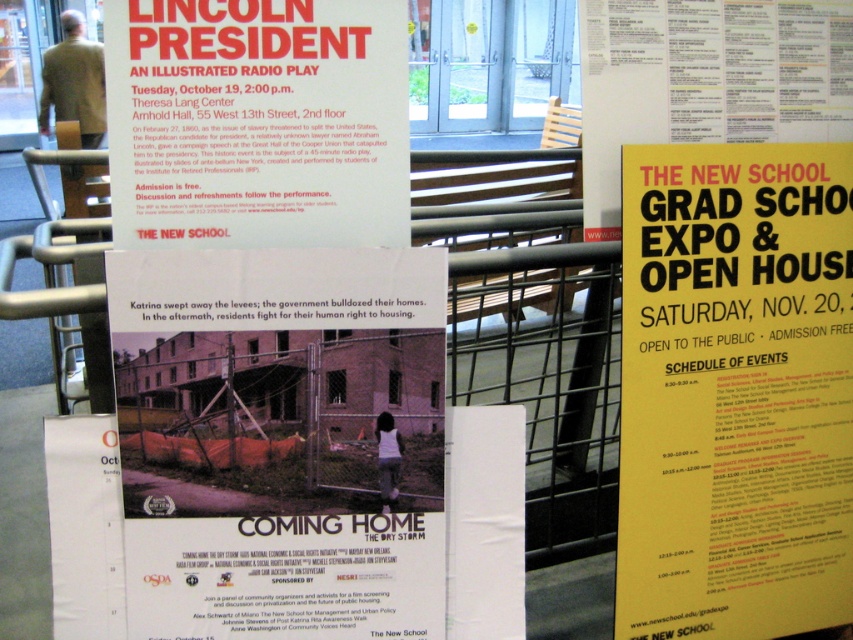
Does yellow paper at upper right appear on the right side of matte red poster at upper left?

Indeed, yellow paper at upper right is positioned on the right side of matte red poster at upper left.

Does yellow paper at upper right appear on the left side of matte red poster at upper left?

In fact, yellow paper at upper right is to the right of matte red poster at upper left.

The width and height of the screenshot is (853, 640). What are the coordinates of `yellow paper at upper right` in the screenshot? It's located at (735, 390).

You are a GUI agent. You are given a task and a screenshot of the screen. Output one action in this format:
    pyautogui.click(x=<x>, y=<y>)
    Task: Click on the yellow paper at upper right
    
    Given the screenshot: What is the action you would take?
    pyautogui.click(x=735, y=390)